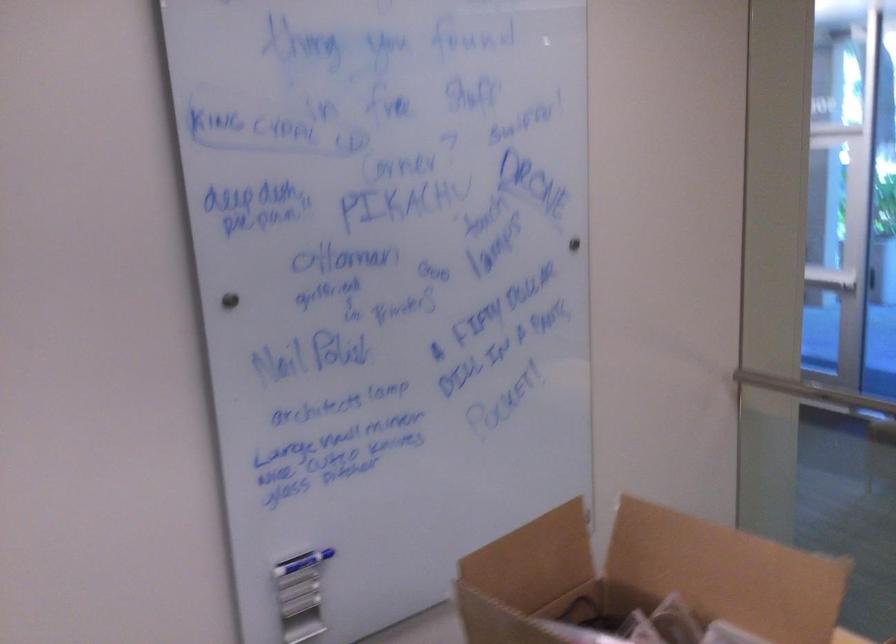
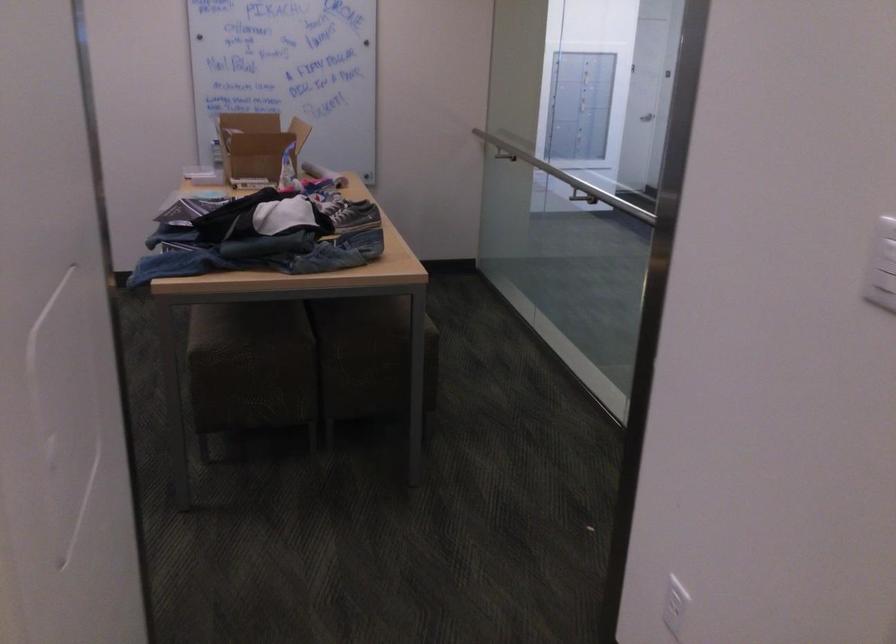
Question: I am providing you with two images of the same scene from different viewpoints. Please identify which objects are invisible in image2.

Choices:
 (A) cardboard box flap
 (B) cardboard box
 (C) gray sneaker
 (D) projector screen bar

Answer: (A)